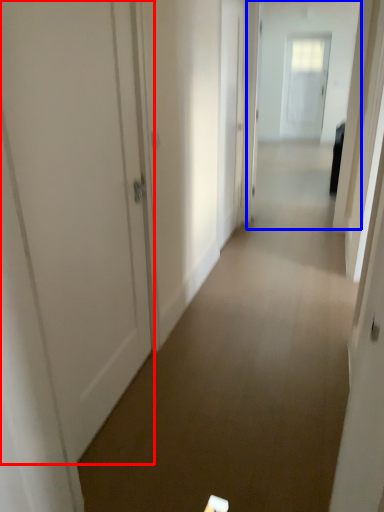
Question: Among these objects, which one is farthest to the camera, door (highlighted by a red box) or passage (highlighted by a blue box)?

Choices:
 (A) door
 (B) passage

Answer: (B)